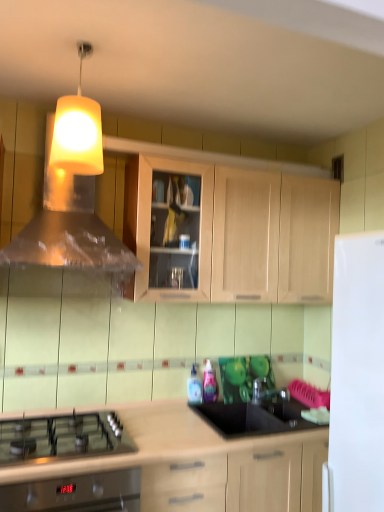
Measure the distance between point (x=285, y=396) and camera.

Point (x=285, y=396) and camera are 8.06 feet apart from each other.

Measure the distance between point [145,478] and camera.

1.79 meters.

Describe the element at coordinates (164, 460) in the screenshot. This screenshot has height=512, width=384. I see `light wood cabinet at lower center, the 2th cabinetry when ordered from top to bottom` at that location.

Find the location of a particular element. The width and height of the screenshot is (384, 512). translucent plastic bottle at center, the 1th bottle from the left is located at coordinates (194, 387).

The image size is (384, 512). I want to click on translucent plastic bottle at center, marked as the first bottle in a right-to-left arrangement, so click(210, 384).

From the image's perspective, is translucent plastic vent at upper center on yellow matte lampshade at upper center?

No, from the image's perspective, translucent plastic vent at upper center is not over yellow matte lampshade at upper center.

In the image, is translucent plastic vent at upper center positioned in front of or behind yellow matte lampshade at upper center?

Clearly, translucent plastic vent at upper center is behind yellow matte lampshade at upper center.

Where is `vent that appears behind the yellow matte lampshade at upper center`? vent that appears behind the yellow matte lampshade at upper center is located at coordinates (69, 231).

In the scene shown: Does translucent plastic vent at upper center appear on the right side of yellow matte lampshade at upper center?

No, translucent plastic vent at upper center is not to the right of yellow matte lampshade at upper center.

Visually, is black glass gas stove at lower left positioned to the left or to the right of translucent plastic vent at upper center?

In the image, black glass gas stove at lower left appears on the left side of translucent plastic vent at upper center.

Which point is more forward, (18, 436) or (13, 246)?

Positioned in front is point (18, 436).

Is black glass gas stove at lower left bigger than translucent plastic vent at upper center?

Actually, black glass gas stove at lower left might be smaller than translucent plastic vent at upper center.

Locate an element on the screen. This screenshot has width=384, height=512. gas stove in front of the translucent plastic vent at upper center is located at coordinates (63, 437).

Is light wood cabinet at upper center, which appears as the 1th cabinetry when viewed from the top, spatially inside light wood cabinet at lower center, the first cabinetry from the bottom, or outside of it?

light wood cabinet at upper center, which appears as the 1th cabinetry when viewed from the top, exists outside the volume of light wood cabinet at lower center, the first cabinetry from the bottom.

Is light wood cabinet at upper center, which appears as the 1th cabinetry when viewed from the top, at the left side of light wood cabinet at lower center, the first cabinetry from the bottom?

In fact, light wood cabinet at upper center, which appears as the 1th cabinetry when viewed from the top, is to the right of light wood cabinet at lower center, the first cabinetry from the bottom.

Are light wood cabinet at upper center, which appears as the 1th cabinetry when viewed from the top, and light wood cabinet at lower center, the first cabinetry from the bottom, beside each other?

There is a gap between light wood cabinet at upper center, which appears as the 1th cabinetry when viewed from the top, and light wood cabinet at lower center, the first cabinetry from the bottom.

Is translucent plastic bottle at center, the second bottle when ordered from left to right, with black glass gas stove at lower left?

translucent plastic bottle at center, the second bottle when ordered from left to right, and black glass gas stove at lower left are clearly separated.

From a real-world perspective, is translucent plastic bottle at center, the second bottle when ordered from left to right, located beneath black glass gas stove at lower left?

No, from a real-world perspective, translucent plastic bottle at center, the second bottle when ordered from left to right, is not below black glass gas stove at lower left.

From a real-world perspective, is black glass gas stove at lower left physically located above or below translucent plastic bottle at center, placed as the 2th bottle when sorted from right to left?

black glass gas stove at lower left is situated lower than translucent plastic bottle at center, placed as the 2th bottle when sorted from right to left, in the real world.

Which is correct: black glass gas stove at lower left is inside translucent plastic bottle at center, the 1th bottle from the left, or outside of it?

The correct answer is: outside.

Which object is positioned more to the right, black glass gas stove at lower left or translucent plastic bottle at center, placed as the 2th bottle when sorted from right to left?

translucent plastic bottle at center, placed as the 2th bottle when sorted from right to left, is more to the right.

Does light wood cabinet at upper center, which appears as the 1th cabinetry when viewed from the top, have a larger size compared to translucent plastic bottle at center, the second bottle when ordered from left to right?

Indeed, light wood cabinet at upper center, which appears as the 1th cabinetry when viewed from the top, has a larger size compared to translucent plastic bottle at center, the second bottle when ordered from left to right.

Would you consider light wood cabinet at upper center, which ranks as the 2th cabinetry in bottom-to-top order, to be distant from translucent plastic bottle at center, marked as the first bottle in a right-to-left arrangement?

No, light wood cabinet at upper center, which ranks as the 2th cabinetry in bottom-to-top order, is in close proximity to translucent plastic bottle at center, marked as the first bottle in a right-to-left arrangement.

In the scene shown: Considering the positions of objects light wood cabinet at upper center, which ranks as the 2th cabinetry in bottom-to-top order, and translucent plastic bottle at center, marked as the first bottle in a right-to-left arrangement, in the image provided, who is in front, light wood cabinet at upper center, which ranks as the 2th cabinetry in bottom-to-top order, or translucent plastic bottle at center, marked as the first bottle in a right-to-left arrangement,?

light wood cabinet at upper center, which ranks as the 2th cabinetry in bottom-to-top order, is closer to the camera.

Is light wood cabinet at upper center, which ranks as the 2th cabinetry in bottom-to-top order, taller than translucent plastic bottle at center, marked as the first bottle in a right-to-left arrangement?

Indeed, light wood cabinet at upper center, which ranks as the 2th cabinetry in bottom-to-top order, has a greater height compared to translucent plastic bottle at center, marked as the first bottle in a right-to-left arrangement.

Is black glass gas stove at lower left oriented towards translucent plastic bottle at center, the second bottle when ordered from left to right?

No, black glass gas stove at lower left is not turned towards translucent plastic bottle at center, the second bottle when ordered from left to right.

Identify the location of bottle that is the 2nd one when counting backward from the black glass gas stove at lower left. Image resolution: width=384 pixels, height=512 pixels. (210, 384).

From the image's perspective, which is below, black glass gas stove at lower left or translucent plastic bottle at center, the second bottle when ordered from left to right?

From the image's view, black glass gas stove at lower left is below.

How many degrees apart are the facing directions of black glass gas stove at lower left and translucent plastic bottle at center, marked as the first bottle in a right-to-left arrangement?

They differ by 5.98 degrees in their facing directions.

Locate an element on the screen. This screenshot has height=512, width=384. vent that appears below the yellow matte lampshade at upper center (from the image's perspective) is located at coordinates (69, 231).

The image size is (384, 512). I want to click on vent above the black glass gas stove at lower left (from the image's perspective), so click(x=69, y=231).

When comparing their distances from translucent plastic vent at upper center, does translucent plastic bottle at center, the 1th bottle from the left, or light wood cabinet at lower center, the first cabinetry from the bottom, seem further?

translucent plastic bottle at center, the 1th bottle from the left, is further to translucent plastic vent at upper center.

Considering their positions, is yellow matte lampshade at upper center positioned closer to transparent glass tap at center than black glass gas stove at lower left?

Among the two, black glass gas stove at lower left is located nearer to transparent glass tap at center.

Considering their positions, is light wood cabinet at upper center, which ranks as the 2th cabinetry in bottom-to-top order, positioned further to light wood cabinet at lower center, the 2th cabinetry when ordered from top to bottom, than yellow matte lampshade at upper center?

yellow matte lampshade at upper center.

From the image, which object appears to be farther from light wood cabinet at lower center, the first cabinetry from the bottom, yellow matte lampshade at upper center or translucent plastic bottle at center, the second bottle when ordered from left to right?

yellow matte lampshade at upper center lies further to light wood cabinet at lower center, the first cabinetry from the bottom, than the other object.

Based on their spatial positions, is translucent plastic bottle at center, placed as the 2th bottle when sorted from right to left, or light wood cabinet at upper center, which appears as the 1th cabinetry when viewed from the top, closer to light wood cabinet at lower center, the 2th cabinetry when ordered from top to bottom?

The object closer to light wood cabinet at lower center, the 2th cabinetry when ordered from top to bottom, is translucent plastic bottle at center, placed as the 2th bottle when sorted from right to left.

Looking at the image, which one is located closer to transparent glass tap at center, translucent plastic vent at upper center or translucent plastic bottle at center, marked as the first bottle in a right-to-left arrangement?

The object closer to transparent glass tap at center is translucent plastic bottle at center, marked as the first bottle in a right-to-left arrangement.

Looking at the image, which one is located further to light wood cabinet at upper center, which ranks as the 2th cabinetry in bottom-to-top order, translucent plastic bottle at center, placed as the 2th bottle when sorted from right to left, or translucent plastic bottle at center, marked as the first bottle in a right-to-left arrangement?

translucent plastic bottle at center, placed as the 2th bottle when sorted from right to left.

Considering their positions, is translucent plastic vent at upper center positioned further to yellow matte lampshade at upper center than light wood cabinet at lower center, the first cabinetry from the bottom?

light wood cabinet at lower center, the first cabinetry from the bottom, is further to yellow matte lampshade at upper center.

The height and width of the screenshot is (512, 384). I want to click on bottle between yellow matte lampshade at upper center and translucent plastic bottle at center, the 1th bottle from the left, from top to bottom, so click(x=210, y=384).

Identify the location of tap between yellow matte lampshade at upper center and black glass gas stove at lower left in the vertical direction. The height and width of the screenshot is (512, 384). (267, 392).

Where is `vent that lies between yellow matte lampshade at upper center and light wood cabinet at lower center, the 2th cabinetry when ordered from top to bottom, from top to bottom`? The height and width of the screenshot is (512, 384). vent that lies between yellow matte lampshade at upper center and light wood cabinet at lower center, the 2th cabinetry when ordered from top to bottom, from top to bottom is located at coordinates (69, 231).

The image size is (384, 512). In order to click on tap that lies between yellow matte lampshade at upper center and light wood cabinet at lower center, the first cabinetry from the bottom, from top to bottom in this screenshot , I will do 267,392.